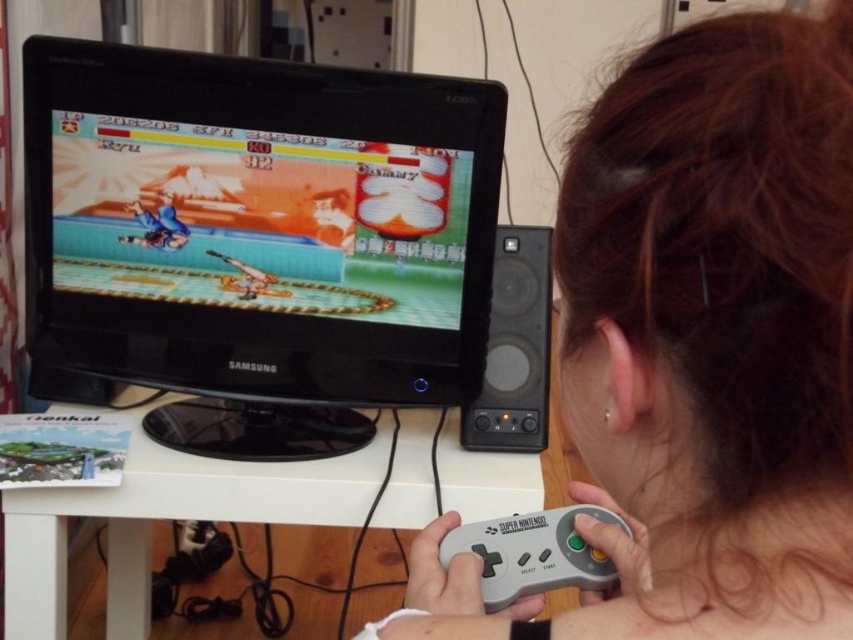
Question: Among these points, which one is farthest from the camera?

Choices:
 (A) (109, 548)
 (B) (527, 538)
 (C) (254, 262)

Answer: (A)

Question: Considering the relative positions of matte black monitor at center and gray matte game controller at lower center in the image provided, where is matte black monitor at center located with respect to gray matte game controller at lower center?

Choices:
 (A) right
 (B) left

Answer: (B)

Question: Does matte black monitor at center have a larger size compared to white plastic table at lower center?

Choices:
 (A) yes
 (B) no

Answer: (A)

Question: Considering the real-world distances, which object is farthest from the gray matte controller at lower center?

Choices:
 (A) white plastic table at lower center
 (B) gray matte game controller at lower center
 (C) matte black monitor at center

Answer: (C)

Question: Which point is farther to the camera?

Choices:
 (A) (314, 67)
 (B) (515, 524)
 (C) (24, 524)
 (D) (798, 237)

Answer: (A)

Question: Is white plastic table at lower center positioned in front of gray matte game controller at lower center?

Choices:
 (A) yes
 (B) no

Answer: (B)